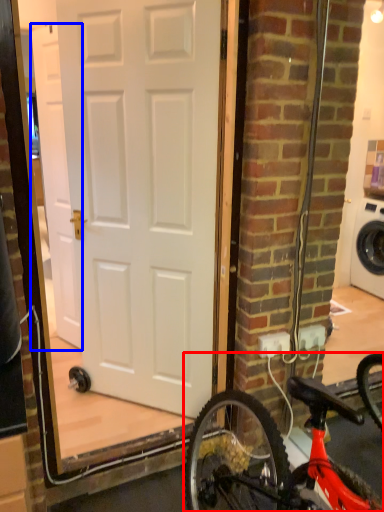
Question: Which point is further to the camera, bicycle (highlighted by a red box) or door (highlighted by a blue box)?

Choices:
 (A) bicycle
 (B) door

Answer: (B)